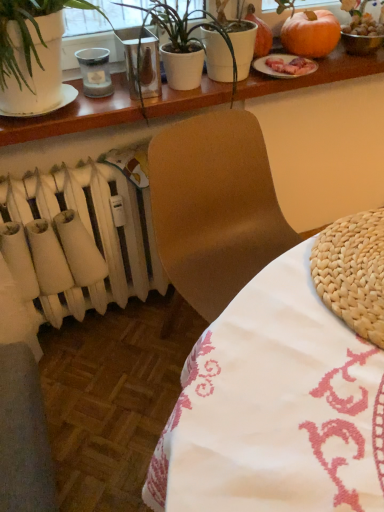
Where is `vacant space situated above white ceramic plate at upper right (from a real-world perspective)`? vacant space situated above white ceramic plate at upper right (from a real-world perspective) is located at coordinates (285, 59).